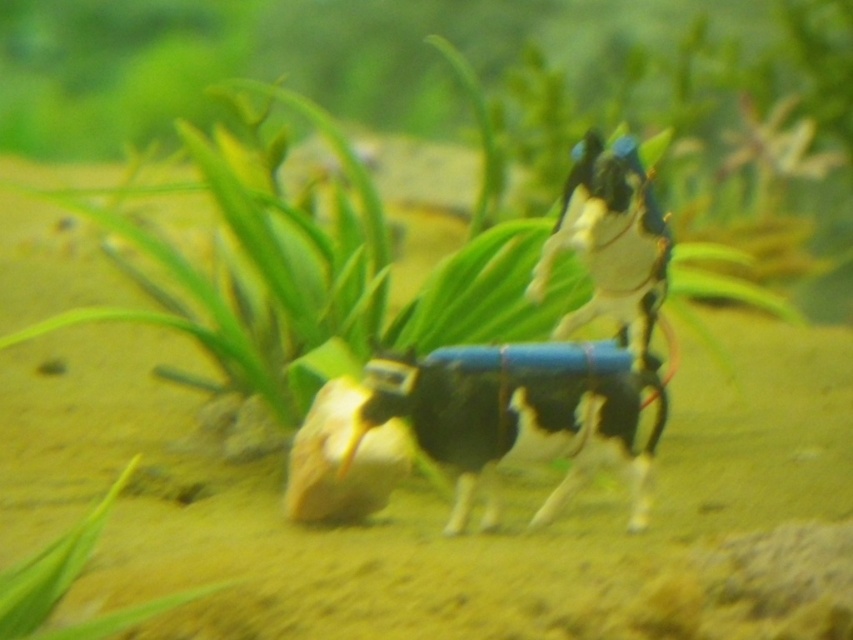
Looking at this image, you are a small fish swimming in the aquarium. You see two points in the water, point A at coordinates point (x=541, y=444) and point B at coordinates point (x=97, y=502). Which point is closer to you as you swim towards the front of the aquarium?

Point A at coordinates point (x=541, y=444) is closer to you because it is in front of point B at coordinates point (x=97, y=502).

What is the position of the point at coordinates (517, 419) in relation to the black matte cow at center?

The point at coordinates (517, 419) is located on the black matte cow at center.